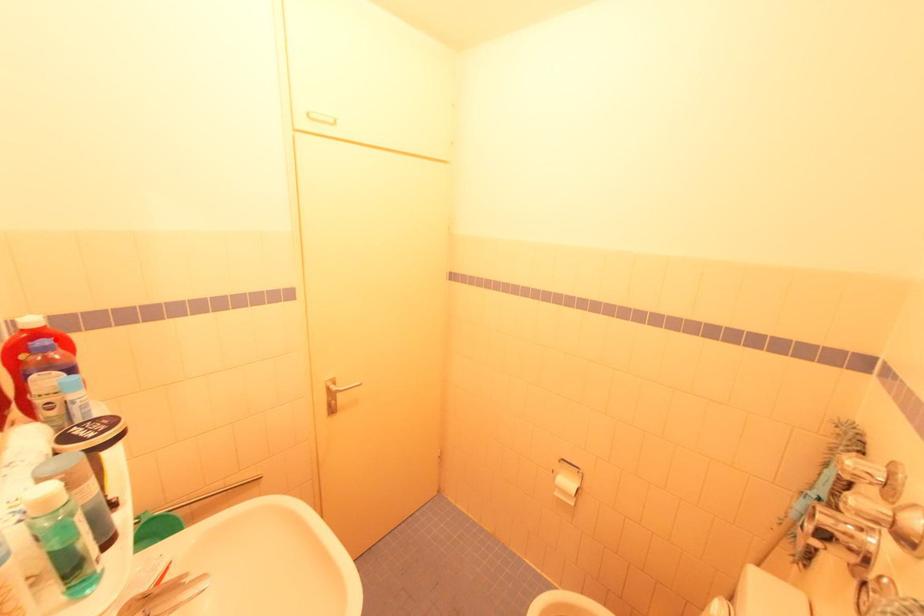
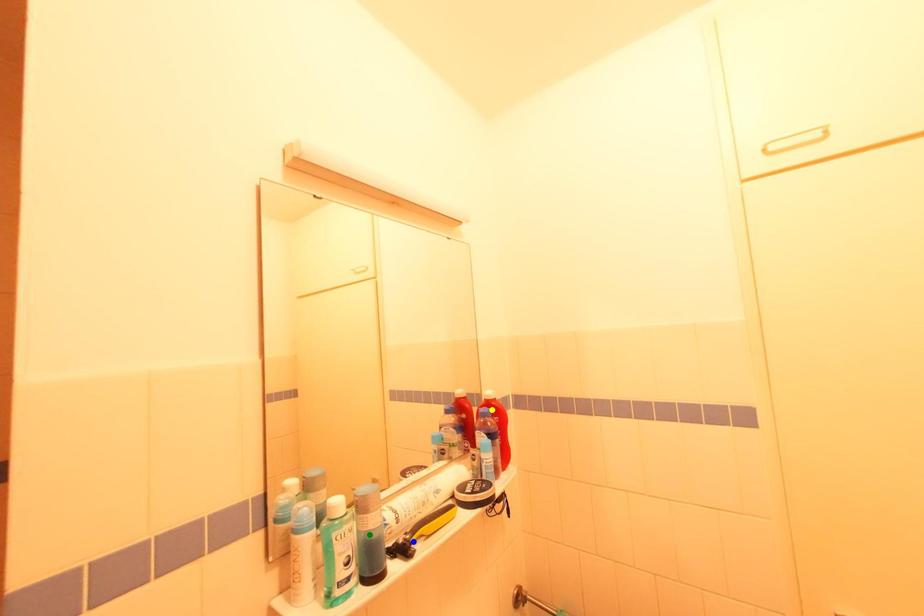
Question: I am providing you with two images of the same scene from different viewpoints. A red point is marked on the first image. You are given multiple points on the second image. Which spot in image 2 lines up with the point in image 1?

Choices:
 (A) blue point
 (B) yellow point
 (C) green point

Answer: (B)